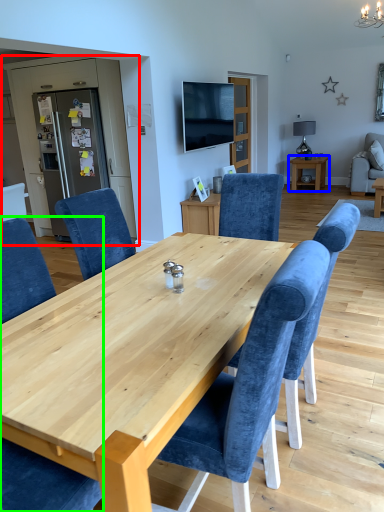
Question: Which object is the farthest from entertainment center (highlighted by a red box)? Choose among these: table (highlighted by a blue box) or chair (highlighted by a green box).

Choices:
 (A) table
 (B) chair

Answer: (B)